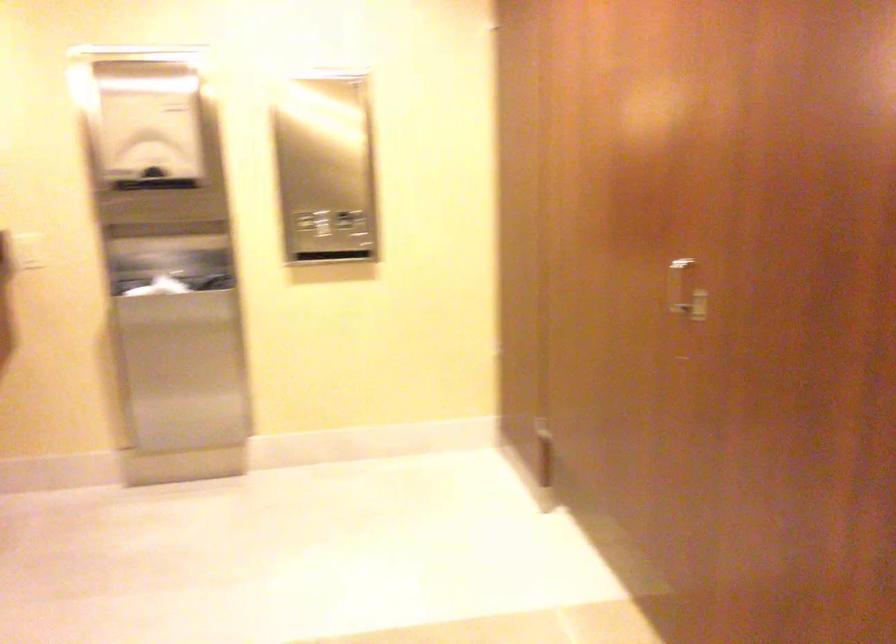
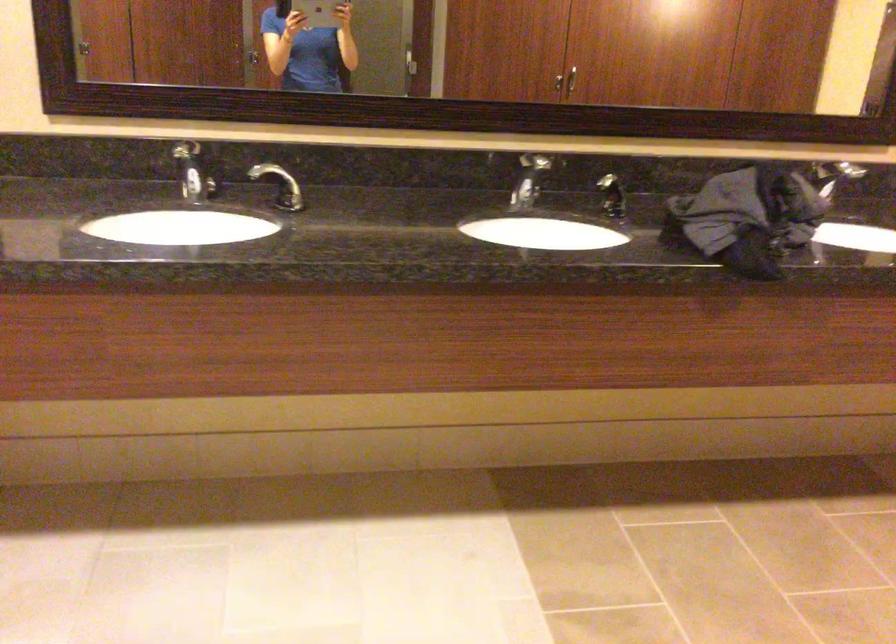
The images are taken continuously from a first-person perspective. In which direction is your viewpoint rotating?

The camera's rotation is toward left-down.